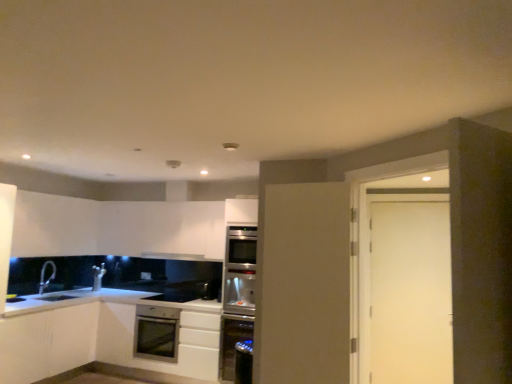
What is the approximate width of satin silver microwave at lower center?

It is 7.91 inches.

This screenshot has width=512, height=384. Describe the element at coordinates (160, 356) in the screenshot. I see `satin white cabinet at lower center, marked as the first cabinetry in a right-to-left arrangement` at that location.

Identify the location of satin silver oven at lower center. [156, 333].

Where is `white matte cabinet at lower left, the 1th cabinetry viewed from the left`? Image resolution: width=512 pixels, height=384 pixels. white matte cabinet at lower left, the 1th cabinetry viewed from the left is located at coordinates (47, 343).

From the image's perspective, between satin silver exhaust hood at upper center and satin white cabinet at lower center, marked as the first cabinetry in a right-to-left arrangement, which one is located above?

satin silver exhaust hood at upper center appears higher in the image.

Would you consider satin silver exhaust hood at upper center to be distant from satin white cabinet at lower center, marked as the first cabinetry in a right-to-left arrangement?

Yes, satin silver exhaust hood at upper center is far from satin white cabinet at lower center, marked as the first cabinetry in a right-to-left arrangement.

From a real-world perspective, does satin silver exhaust hood at upper center sit lower than satin white cabinet at lower center, the second cabinetry viewed from the left?

Incorrect, from a real-world perspective, satin silver exhaust hood at upper center is higher than satin white cabinet at lower center, the second cabinetry viewed from the left.

From the image's perspective, is satin stainless steel dishwasher at center above or below satin silver oven at lower center?

satin stainless steel dishwasher at center is situated lower than satin silver oven at lower center in the image.

Is satin stainless steel dishwasher at center far from satin silver oven at lower center?

satin stainless steel dishwasher at center is near satin silver oven at lower center, not far away.

From a real-world perspective, is satin stainless steel dishwasher at center beneath satin silver oven at lower center?

Indeed, from a real-world perspective, satin stainless steel dishwasher at center is positioned beneath satin silver oven at lower center.

Does satin stainless steel dishwasher at center have a greater height compared to satin silver oven at lower center?

Yes.

Is satin silver oven at center positioned with its back to white matte door at right?

No, satin silver oven at center's orientation is not away from white matte door at right.

Is satin silver oven at center surrounding white matte door at right?

No, white matte door at right is not a part of satin silver oven at center.

Is satin silver oven at center in front of or behind white matte door at right in the image?

Clearly, satin silver oven at center is behind white matte door at right.

Considering the positions of objects satin silver exhaust hood at upper center and white matte cabinet at lower left, the second cabinetry viewed from the right, in the image provided, who is more to the left, satin silver exhaust hood at upper center or white matte cabinet at lower left, the second cabinetry viewed from the right,?

Positioned to the left is white matte cabinet at lower left, the second cabinetry viewed from the right.

Is white matte cabinet at lower left, the 1th cabinetry viewed from the left, completely or partially inside satin silver exhaust hood at upper center?

No, white matte cabinet at lower left, the 1th cabinetry viewed from the left, is not inside satin silver exhaust hood at upper center.

Which object is thinner, satin silver exhaust hood at upper center or white matte cabinet at lower left, the second cabinetry viewed from the right?

With smaller width is satin silver exhaust hood at upper center.

Could you tell me if satin white cabinet at lower center, marked as the first cabinetry in a right-to-left arrangement, is turned towards satin stainless steel dishwasher at center?

No, satin white cabinet at lower center, marked as the first cabinetry in a right-to-left arrangement, is not oriented towards satin stainless steel dishwasher at center.

Which is correct: satin white cabinet at lower center, marked as the first cabinetry in a right-to-left arrangement, is inside satin stainless steel dishwasher at center, or outside of it?

satin white cabinet at lower center, marked as the first cabinetry in a right-to-left arrangement, is not enclosed by satin stainless steel dishwasher at center.

Is satin white cabinet at lower center, marked as the first cabinetry in a right-to-left arrangement, at the left side of satin stainless steel dishwasher at center?

Yes.

From a real-world perspective, is satin white cabinet at lower center, marked as the first cabinetry in a right-to-left arrangement, physically located above or below satin stainless steel dishwasher at center?

satin white cabinet at lower center, marked as the first cabinetry in a right-to-left arrangement, is above satin stainless steel dishwasher at center.

Is satin silver oven at lower center inside silver metallic faucet at lower left?

No, silver metallic faucet at lower left does not contain satin silver oven at lower center.

Who is smaller, silver metallic faucet at lower left or satin silver oven at lower center?

silver metallic faucet at lower left.

Is silver metallic faucet at lower left shorter than satin silver oven at lower center?

Correct, silver metallic faucet at lower left is not as tall as satin silver oven at lower center.

Consider the image. Can you confirm if satin silver oven at center is bigger than satin white cabinet at lower center, marked as the first cabinetry in a right-to-left arrangement?

Incorrect, satin silver oven at center is not larger than satin white cabinet at lower center, marked as the first cabinetry in a right-to-left arrangement.

You are a GUI agent. You are given a task and a screenshot of the screen. Output one action in this format:
    pyautogui.click(x=<x>, y=<y>)
    Task: Click on the oven on the right of satin white cabinet at lower center, marked as the first cabinetry in a right-to-left arrangement
    This screenshot has height=384, width=512.
    Given the screenshot: What is the action you would take?
    pyautogui.click(x=240, y=270)

Is satin silver oven at center oriented towards satin white cabinet at lower center, marked as the first cabinetry in a right-to-left arrangement?

No, satin silver oven at center does not turn towards satin white cabinet at lower center, marked as the first cabinetry in a right-to-left arrangement.

Which object is positioned more to the right, satin silver oven at center or satin white cabinet at lower center, the second cabinetry viewed from the left?

satin silver oven at center is more to the right.

From a real-world perspective, starting from the satin silver exhaust hood at upper center, which cabinetry is the 2nd one below it? Please provide its 2D coordinates.

[(160, 356)]

This screenshot has width=512, height=384. I want to click on kitchen appliance behind the satin stainless steel dishwasher at center, so click(x=156, y=333).

When comparing their distances from satin silver oven at center, does satin silver oven at lower center or satin white cabinet at lower center, marked as the first cabinetry in a right-to-left arrangement, seem closer?

The object closer to satin silver oven at center is satin white cabinet at lower center, marked as the first cabinetry in a right-to-left arrangement.

Estimate the real-world distances between objects in this image. Which object is further from satin silver oven at center, satin stainless steel dishwasher at center or satin silver oven at lower center?

satin silver oven at lower center.

Estimate the real-world distances between objects in this image. Which object is further from satin white cabinet at lower center, marked as the first cabinetry in a right-to-left arrangement, white matte cabinet at lower left, the second cabinetry viewed from the right, or satin silver oven at lower center?

white matte cabinet at lower left, the second cabinetry viewed from the right, lies further to satin white cabinet at lower center, marked as the first cabinetry in a right-to-left arrangement, than the other object.

From the image, which object appears to be farther from satin stainless steel dishwasher at center, satin silver oven at lower center or satin silver microwave at lower center?

satin silver microwave at lower center lies further to satin stainless steel dishwasher at center than the other object.

Based on their spatial positions, is silver metallic faucet at lower left or satin stainless steel dishwasher at center further from satin silver oven at center?

Based on the image, silver metallic faucet at lower left appears to be further to satin silver oven at center.

Considering their positions, is satin white cabinet at lower center, the second cabinetry viewed from the left, positioned further to silver metallic faucet at lower left than satin silver microwave at lower center?

satin white cabinet at lower center, the second cabinetry viewed from the left, lies further to silver metallic faucet at lower left than the other object.

Which object lies nearer to the anchor point satin silver oven at center, white matte cabinet at lower left, the second cabinetry viewed from the right, or satin silver oven at lower center?

satin silver oven at lower center is positioned closer to the anchor satin silver oven at center.

Estimate the real-world distances between objects in this image. Which object is closer to white matte door at right, satin silver oven at lower center or satin silver exhaust hood at upper center?

satin silver exhaust hood at upper center is positioned closer to the anchor white matte door at right.

This screenshot has width=512, height=384. What are the coordinates of `oven between silver metallic faucet at lower left and white matte door at right from left to right` in the screenshot? It's located at (240, 270).

Where is `kitchen appliance between satin silver microwave at lower center and white matte door at right in the horizontal direction`? kitchen appliance between satin silver microwave at lower center and white matte door at right in the horizontal direction is located at coordinates (156, 333).

Locate an element on the screen. This screenshot has height=384, width=512. appliance between white matte cabinet at lower left, the second cabinetry viewed from the right, and satin silver oven at center from left to right is located at coordinates (98, 276).

Locate an element on the screen. kitchen appliance located between white matte cabinet at lower left, the second cabinetry viewed from the right, and satin silver microwave at lower center in the depth direction is located at coordinates (156, 333).